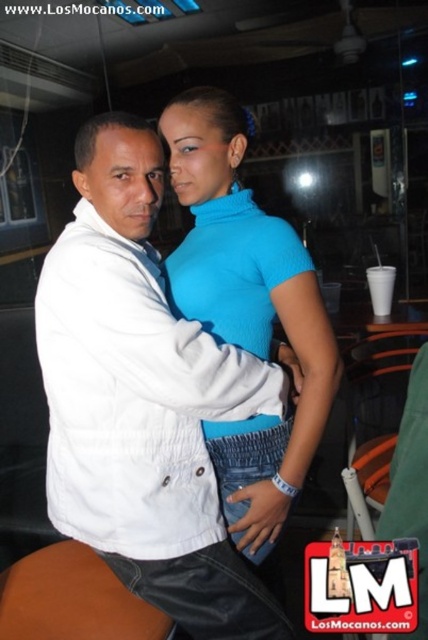
Question: Does white matte jacket at center have a smaller size compared to brown leather stool at lower left?

Choices:
 (A) yes
 (B) no

Answer: (B)

Question: Which point is closer to the camera taking this photo?

Choices:
 (A) (68, 611)
 (B) (39, 310)
 (C) (225, 481)

Answer: (B)

Question: Is white matte jacket at center positioned at the back of brown leather stool at lower left?

Choices:
 (A) yes
 (B) no

Answer: (B)

Question: Which point is farther to the camera?

Choices:
 (A) blue turtleneck at center
 (B) white matte jacket at center

Answer: (A)

Question: Based on their relative distances, which object is nearer to the white matte jacket at center?

Choices:
 (A) brown leather stool at lower left
 (B) blue turtleneck at center

Answer: (B)

Question: Observing the image, what is the correct spatial positioning of white matte jacket at center in reference to brown leather stool at lower left?

Choices:
 (A) below
 (B) above

Answer: (B)